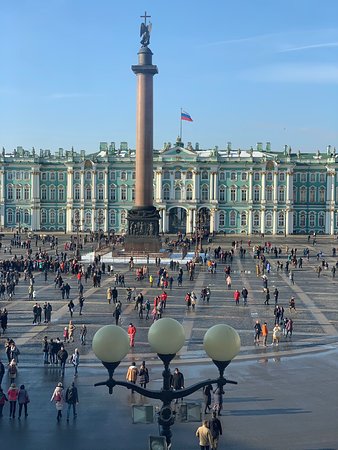
Image resolution: width=338 pixels, height=450 pixels. I want to click on window, so click(x=233, y=176), click(x=100, y=193).